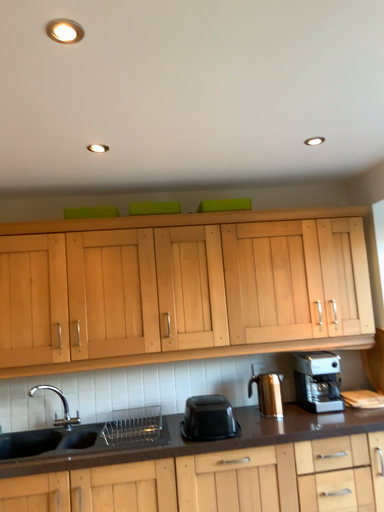
Describe the element at coordinates (208, 419) in the screenshot. I see `black plastic container at center` at that location.

This screenshot has height=512, width=384. I want to click on silver metallic coffee maker at lower right, so click(318, 381).

In order to face black matte sink at lower left, should I rotate leftwards or rightwards?

To face it directly, rotate left by 14.591 degrees.

The width and height of the screenshot is (384, 512). What are the coordinates of `black plastic container at center` in the screenshot? It's located at (208, 419).

Consider the image. Between silver metallic coffee maker at lower right and black plastic container at center, which one has smaller size?

black plastic container at center.

Can you tell me how much silver metallic coffee maker at lower right and black plastic container at center differ in facing direction?

The angular difference between silver metallic coffee maker at lower right and black plastic container at center is 1.41 degrees.

This screenshot has width=384, height=512. In order to click on kitchen appliance below the silver metallic coffee maker at lower right (from a real-world perspective) in this screenshot , I will do `click(208, 419)`.

Which object is wider, silver metallic coffee maker at lower right or black plastic container at center?

black plastic container at center.

The width and height of the screenshot is (384, 512). Find the location of `sink on the left side of shiny metallic coffee maker at right`. sink on the left side of shiny metallic coffee maker at right is located at coordinates (88, 436).

Is shiny metallic coffee maker at right at the left side of black matte sink at lower left?

Incorrect, shiny metallic coffee maker at right is not on the left side of black matte sink at lower left.

How much distance is there between shiny metallic coffee maker at right and black matte sink at lower left?

The distance of shiny metallic coffee maker at right from black matte sink at lower left is 33.78 inches.

Does shiny metallic coffee maker at right have a larger size compared to black matte sink at lower left?

Incorrect, shiny metallic coffee maker at right is not larger than black matte sink at lower left.

Looking at the image, does shiny metallic coffee maker at right seem bigger or smaller compared to silver metallic coffee maker at lower right?

shiny metallic coffee maker at right is smaller than silver metallic coffee maker at lower right.

Is shiny metallic coffee maker at right not close to silver metallic coffee maker at lower right?

No, shiny metallic coffee maker at right is in close proximity to silver metallic coffee maker at lower right.

From the image's perspective, is shiny metallic coffee maker at right positioned above or below silver metallic coffee maker at lower right?

Based on their image positions, shiny metallic coffee maker at right is located beneath silver metallic coffee maker at lower right.

Where is `home appliance on the right side of shiny metallic coffee maker at right`? This screenshot has height=512, width=384. home appliance on the right side of shiny metallic coffee maker at right is located at coordinates (318, 381).

Is black matte sink at lower left to the right of black plastic container at center from the viewer's perspective?

Incorrect, black matte sink at lower left is not on the right side of black plastic container at center.

This screenshot has height=512, width=384. What are the coordinates of `sink in front of the black plastic container at center` in the screenshot? It's located at (88, 436).

How many degrees apart are the facing directions of black matte sink at lower left and black plastic container at center?

1.89 degrees separate the facing orientations of black matte sink at lower left and black plastic container at center.

Is point (264, 402) closer or farther from the camera than point (191, 418)?

Point (264, 402) is positioned farther from the camera compared to point (191, 418).

Considering the relative sizes of shiny metallic coffee maker at right and black plastic container at center in the image provided, is shiny metallic coffee maker at right bigger than black plastic container at center?

Actually, shiny metallic coffee maker at right might be smaller than black plastic container at center.

Which is behind, shiny metallic coffee maker at right or black plastic container at center?

shiny metallic coffee maker at right is further from the camera.

Considering the sizes of objects shiny metallic coffee maker at right and black plastic container at center in the image provided, who is thinner, shiny metallic coffee maker at right or black plastic container at center?

With smaller width is shiny metallic coffee maker at right.

Is there a large distance between silver metallic coffee maker at lower right and shiny metallic coffee maker at right?

No.

From the image's perspective, is silver metallic coffee maker at lower right located beneath shiny metallic coffee maker at right?

No.

Considering the relative sizes of silver metallic coffee maker at lower right and shiny metallic coffee maker at right in the image provided, is silver metallic coffee maker at lower right shorter than shiny metallic coffee maker at right?

No, silver metallic coffee maker at lower right is not shorter than shiny metallic coffee maker at right.

Between silver metallic coffee maker at lower right and shiny metallic coffee maker at right, which one has smaller size?

shiny metallic coffee maker at right.

Considering the sizes of objects black matte sink at lower left and silver metallic coffee maker at lower right in the image provided, who is wider, black matte sink at lower left or silver metallic coffee maker at lower right?

black matte sink at lower left is wider.

Is black matte sink at lower left oriented away from silver metallic coffee maker at lower right?

No, black matte sink at lower left is not facing the opposite direction of silver metallic coffee maker at lower right.

Find the location of a particular element. The width and height of the screenshot is (384, 512). home appliance above the black plastic container at center (from a real-world perspective) is located at coordinates (318, 381).

Find the location of a particular element. coffee machine above the black matte sink at lower left (from the image's perspective) is located at coordinates (268, 394).

Estimate the real-world distances between objects in this image. Which object is further from shiny metallic coffee maker at right, black plastic container at center or silver metallic coffee maker at lower right?

black plastic container at center.

From the image, which object appears to be farther from silver metallic coffee maker at lower right, black matte sink at lower left or black plastic container at center?

Based on the image, black matte sink at lower left appears to be further to silver metallic coffee maker at lower right.

Based on their spatial positions, is shiny metallic coffee maker at right or silver metallic coffee maker at lower right closer to black matte sink at lower left?

shiny metallic coffee maker at right lies closer to black matte sink at lower left than the other object.

Looking at this image, when comparing their distances from silver metallic coffee maker at lower right, does black plastic container at center or black matte sink at lower left seem further?

The object further to silver metallic coffee maker at lower right is black matte sink at lower left.

Estimate the real-world distances between objects in this image. Which object is further from silver metallic coffee maker at lower right, shiny metallic coffee maker at right or black plastic container at center?

black plastic container at center is positioned further to the anchor silver metallic coffee maker at lower right.

Looking at the image, which one is located closer to silver metallic coffee maker at lower right, black plastic container at center or shiny metallic coffee maker at right?

shiny metallic coffee maker at right is closer to silver metallic coffee maker at lower right.

When comparing their distances from black matte sink at lower left, does shiny metallic coffee maker at right or black plastic container at center seem further?

shiny metallic coffee maker at right.

Estimate the real-world distances between objects in this image. Which object is further from shiny metallic coffee maker at right, silver metallic coffee maker at lower right or black matte sink at lower left?

black matte sink at lower left lies further to shiny metallic coffee maker at right than the other object.

Where is `kitchen appliance between black matte sink at lower left and silver metallic coffee maker at lower right`? This screenshot has height=512, width=384. kitchen appliance between black matte sink at lower left and silver metallic coffee maker at lower right is located at coordinates (208, 419).

Where is `coffee machine between black plastic container at center and silver metallic coffee maker at lower right from left to right`? This screenshot has height=512, width=384. coffee machine between black plastic container at center and silver metallic coffee maker at lower right from left to right is located at coordinates (268, 394).

At what (x,y) coordinates should I click in order to perform the action: click on coffee machine between black matte sink at lower left and silver metallic coffee maker at lower right in the horizontal direction. Please return your answer as a coordinate pair (x, y). Image resolution: width=384 pixels, height=512 pixels. Looking at the image, I should click on (268, 394).

Locate an element on the screen. kitchen appliance between black matte sink at lower left and shiny metallic coffee maker at right from left to right is located at coordinates (208, 419).